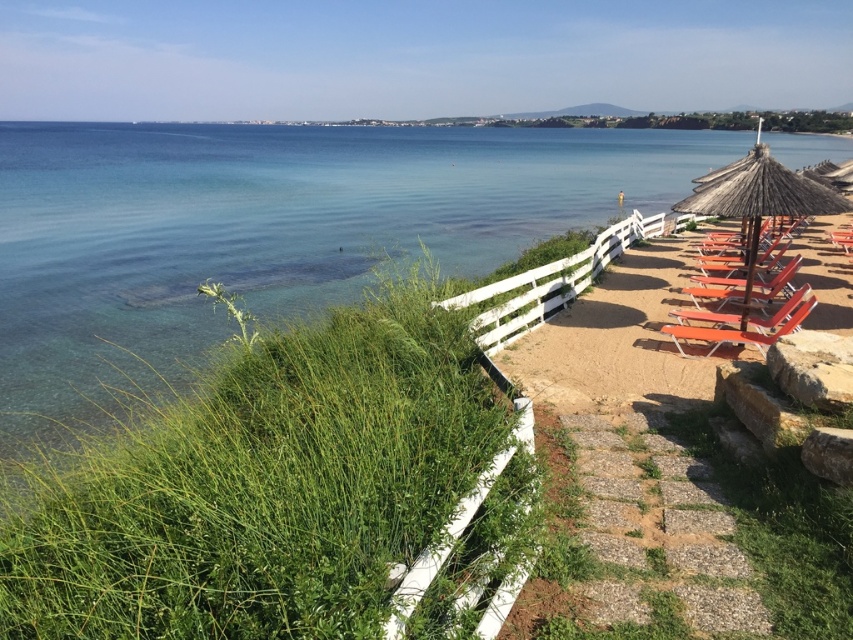
Question: Which of the following is the closest to the observer?

Choices:
 (A) (572, 346)
 (B) (753, 284)
 (C) (720, 145)
 (D) (805, 308)

Answer: (D)

Question: Is thatched straw umbrella at right closer to camera compared to orange plastic beach chair at right?

Choices:
 (A) yes
 (B) no

Answer: (A)

Question: Based on their relative distances, which object is farther from the orange plastic beach chair at right?

Choices:
 (A) matte orange beach chair at right
 (B) thatched straw umbrella at right
 (C) clear blue water at upper left
 (D) orange wood lounge chairs at right

Answer: (C)

Question: Is clear blue water at upper left thinner than thatched straw umbrella at right?

Choices:
 (A) no
 (B) yes

Answer: (A)

Question: Can you confirm if thatched straw umbrella at right is smaller than orange plastic beach chair at right?

Choices:
 (A) yes
 (B) no

Answer: (B)

Question: Which point is closer to the camera taking this photo?

Choices:
 (A) (721, 301)
 (B) (248, 195)
 (C) (801, 300)

Answer: (C)